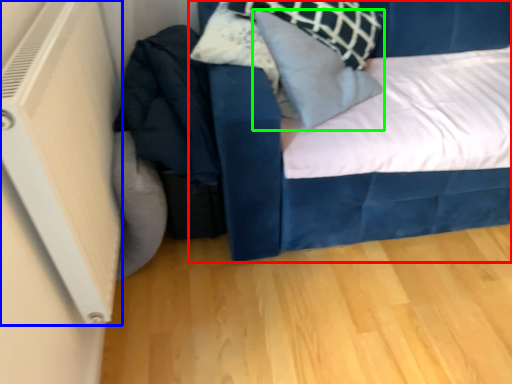
Question: Considering the real-world distances, which object is farthest from bed (highlighted by a red box)? air conditioning (highlighted by a blue box) or pillow (highlighted by a green box)?

Choices:
 (A) air conditioning
 (B) pillow

Answer: (A)